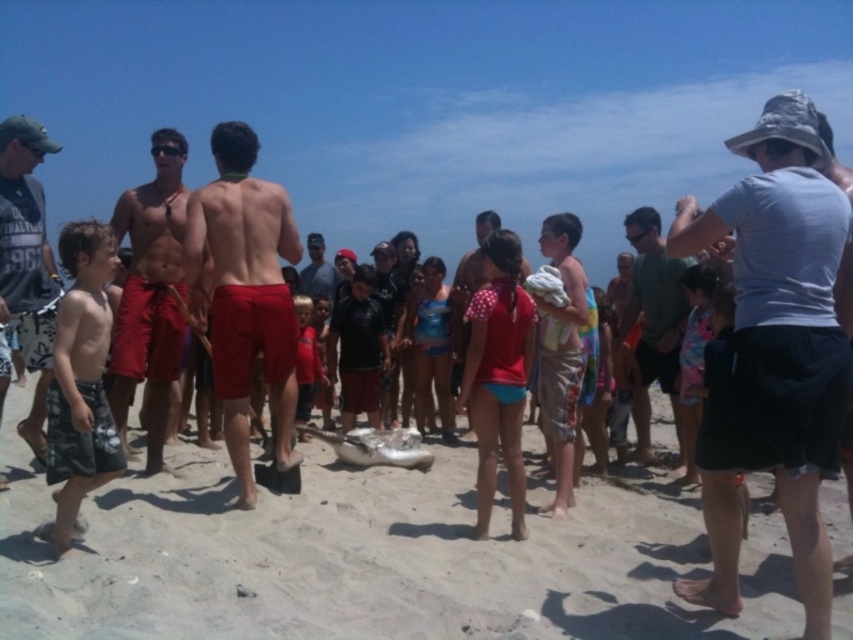
Question: Is shiny red shorts at center to the right of matte gray t-shirt at left from the viewer's perspective?

Choices:
 (A) no
 (B) yes

Answer: (B)

Question: Does shiny red shorts at center appear under gray cotton shirt at right?

Choices:
 (A) yes
 (B) no

Answer: (A)

Question: Considering the real-world distances, which object is closest to the gray cotton shirt at right?

Choices:
 (A) shiny red shorts at center
 (B) light blue t-shirt at center
 (C) red fabric shorts at center
 (D) matte gray t-shirt at left

Answer: (B)

Question: Among these points, which one is farthest from the camera?

Choices:
 (A) tap(651, 240)
 (B) tap(199, 304)
 (C) tap(10, 116)

Answer: (C)

Question: From the image, what is the correct spatial relationship of light blue t-shirt at center in relation to matte gray t-shirt at left?

Choices:
 (A) right
 (B) left

Answer: (A)

Question: Which object is farther from the camera taking this photo?

Choices:
 (A) light blue t-shirt at center
 (B) red fabric shorts at center
 (C) gray cotton shirt at right
 (D) shiny red shorts at center

Answer: (C)